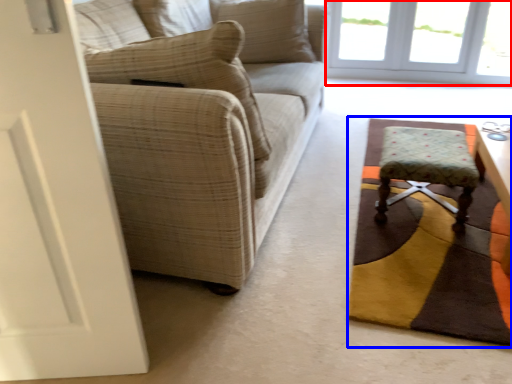
Question: Which point is further to the camera, window (highlighted by a red box) or mat (highlighted by a blue box)?

Choices:
 (A) window
 (B) mat

Answer: (A)